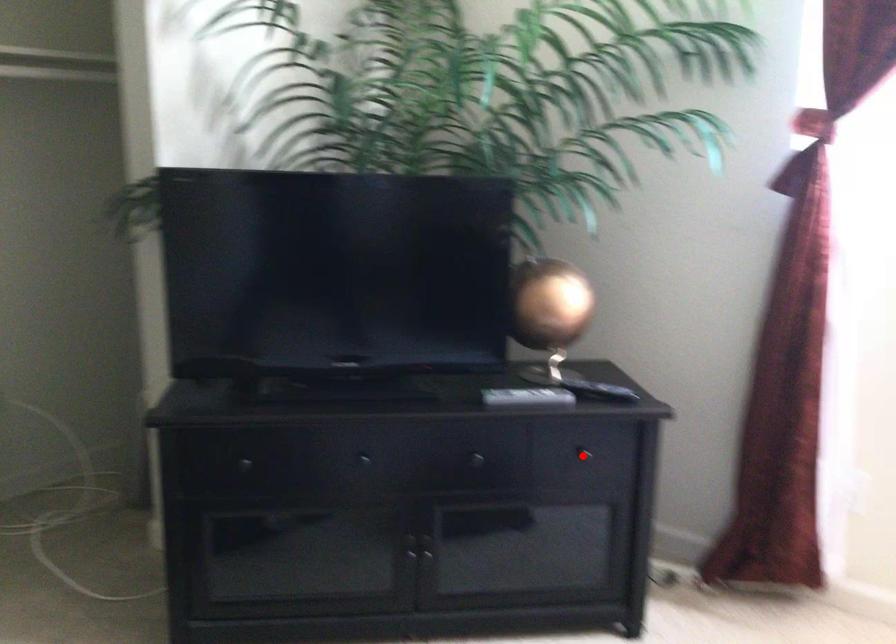
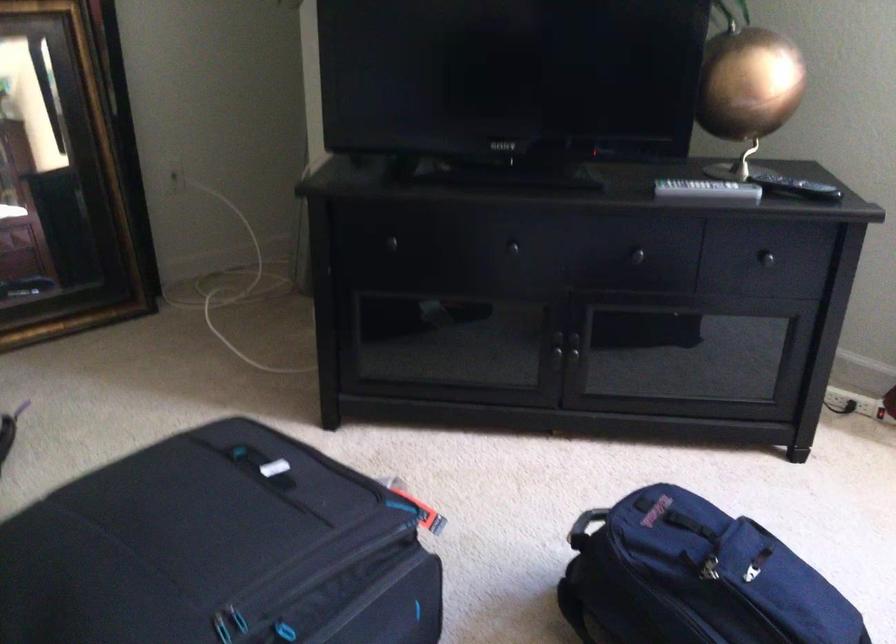
Question: I am providing you with two images of the same scene from different viewpoints. In image1, a red point is highlighted. Considering the same 3D point in image2, which of the following is correct?

Choices:
 (A) It is closer
 (B) It is farther

Answer: (A)